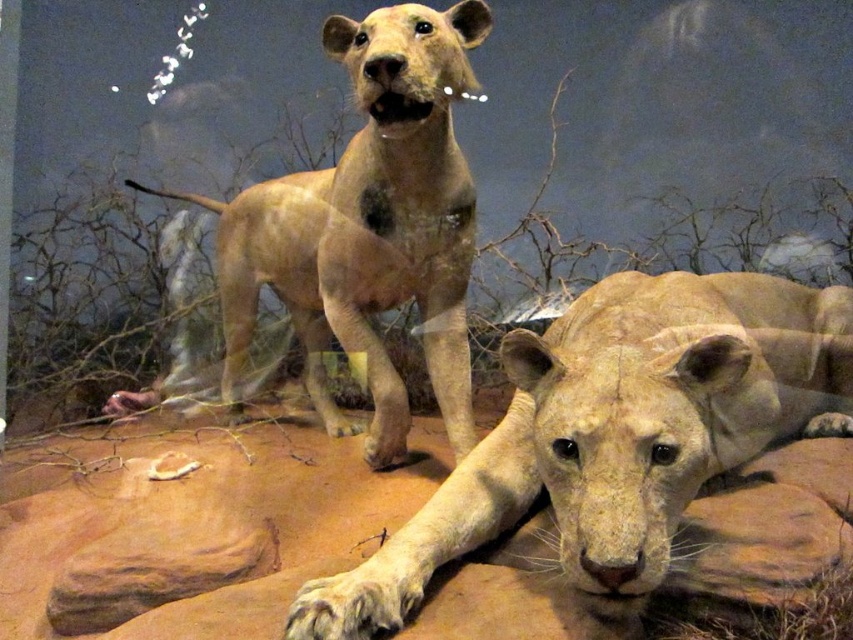
You are a museum visitor observing the lioness figures in the diorama. The light beige fur at center and the light brown fur lion at center are both part of the exhibit. Which of these two lioness figures has a shorter fur length?

The light beige fur at center has shorter fur than the light brown fur lion at center.

You are a museum visitor observing the lioness figures in the diorama. You want to know if the light beige fur at center is closer to you than the light brown fur lion at center. Can you determine this based on their positions?

The light beige fur at center is 4.04 feet from the light brown fur lion at center. Since the light beige fur is at the center and the light brown fur lion is also at the center, their positions overlap, so the distance between them is minimal. Therefore, the light beige fur at center is closer to you than the light brown fur lion at center.

You are standing in front of a museum exhibit of two lioness figures in a savanna diorama. You notice two points marked in the scene at coordinates point (672, 433) and point (373, 410). Which of these points is nearer to you?

Point (672, 433) is closer to the viewer than point (373, 410).